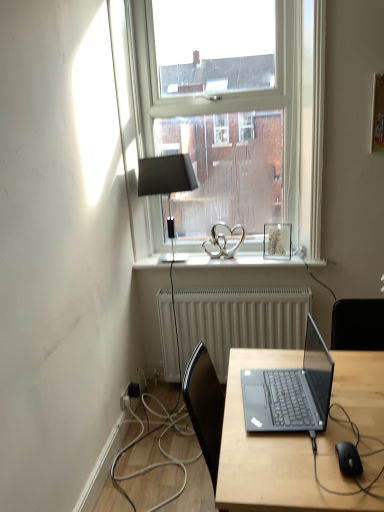
Question: Can you confirm if sleek black laptop at center is wider than black matte computer mouse at lower right?

Choices:
 (A) no
 (B) yes

Answer: (B)

Question: Considering the relative positions of sleek black laptop at center and black matte computer mouse at lower right in the image provided, is sleek black laptop at center in front of black matte computer mouse at lower right?

Choices:
 (A) yes
 (B) no

Answer: (B)

Question: From the image's perspective, is sleek black laptop at center located above black matte computer mouse at lower right?

Choices:
 (A) yes
 (B) no

Answer: (A)

Question: Does sleek black laptop at center have a greater height compared to black matte computer mouse at lower right?

Choices:
 (A) no
 (B) yes

Answer: (B)

Question: Is black matte computer mouse at lower right at the back of sleek black laptop at center?

Choices:
 (A) yes
 (B) no

Answer: (B)

Question: Is sleek black laptop at center oriented towards black matte computer mouse at lower right?

Choices:
 (A) no
 (B) yes

Answer: (A)

Question: From the image's perspective, is white textured radiator at center located beneath sleek black laptop at center?

Choices:
 (A) yes
 (B) no

Answer: (A)

Question: Can you confirm if white textured radiator at center is bigger than sleek black laptop at center?

Choices:
 (A) no
 (B) yes

Answer: (B)

Question: Does white textured radiator at center touch sleek black laptop at center?

Choices:
 (A) yes
 (B) no

Answer: (B)

Question: Is white textured radiator at center turned away from sleek black laptop at center?

Choices:
 (A) no
 (B) yes

Answer: (A)

Question: From a real-world perspective, is white textured radiator at center physically above sleek black laptop at center?

Choices:
 (A) yes
 (B) no

Answer: (B)

Question: From the image's perspective, does white textured radiator at center appear higher than sleek black laptop at center?

Choices:
 (A) no
 (B) yes

Answer: (A)

Question: Does black rubber cable at lower right come in front of clear glass window at upper center?

Choices:
 (A) yes
 (B) no

Answer: (A)